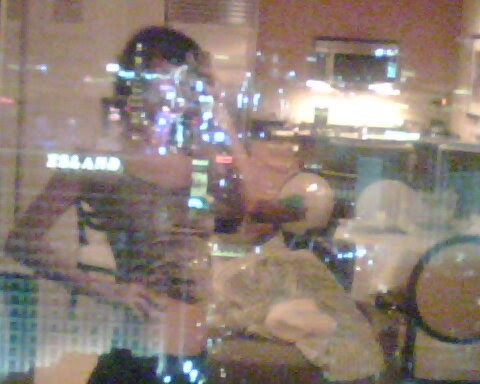
Locate an element on the screen. The image size is (480, 384). white cabinet doors is located at coordinates (4, 80), (41, 86).